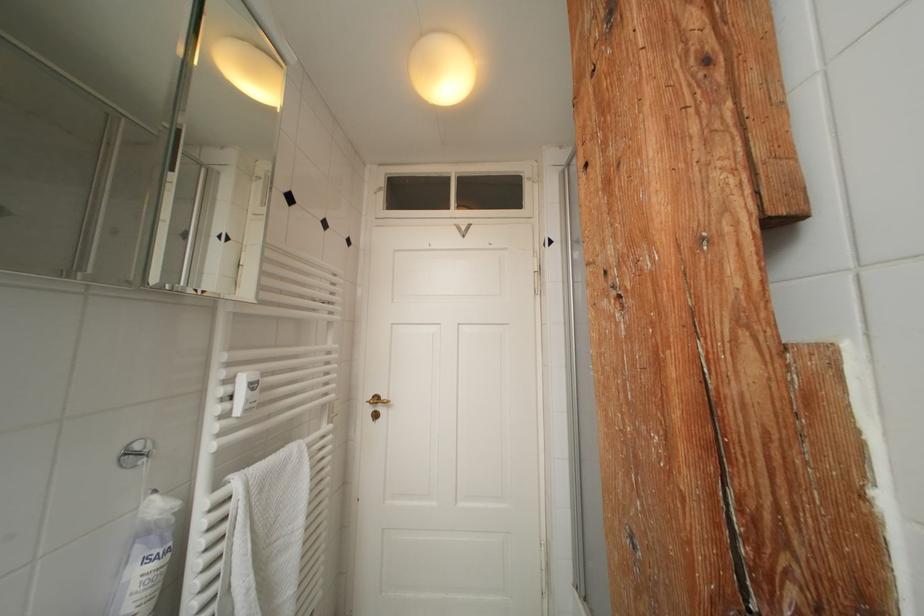
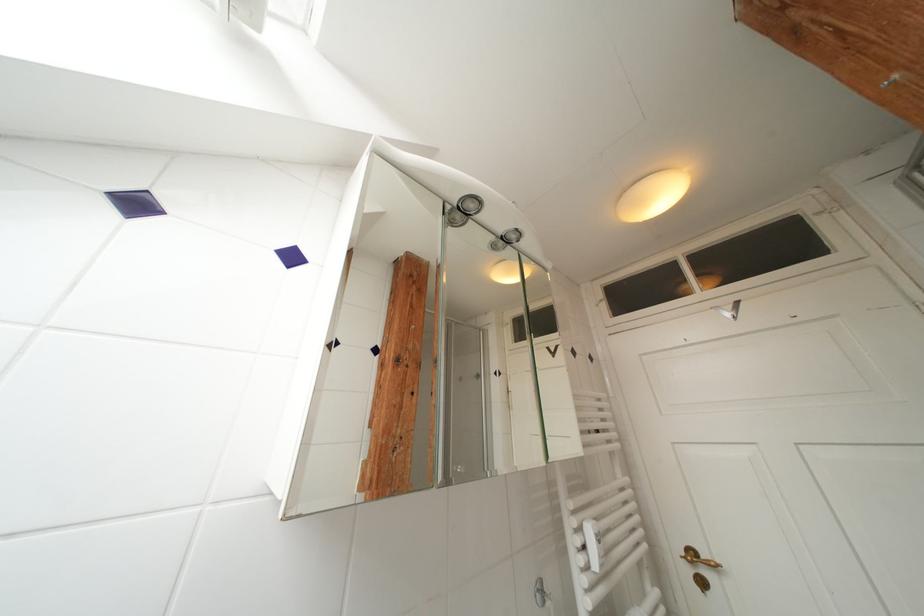
Locate, in the second image, the point that corresponds to [226,240] in the first image.

(502, 377)